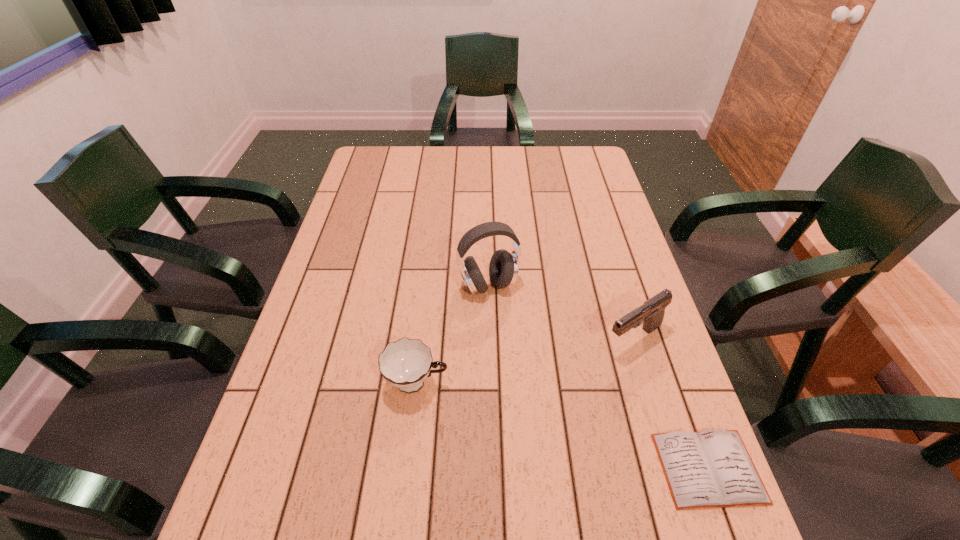
Where is `free region located on the ear cups of the farthest object`? free region located on the ear cups of the farthest object is located at coordinates (541, 437).

The height and width of the screenshot is (540, 960). In order to click on vacant space located 0.390m on the ear cups of the farthest object in this screenshot , I will do `click(543, 442)`.

Locate an element on the screen. free space located on the ear cups of the farthest object is located at coordinates (526, 390).

At what (x,y) coordinates should I click in order to perform the action: click on vacant area located 0.060m aim along the barrel of the third shortest object. Please return your answer as a coordinate pair (x, y). Looking at the image, I should click on (591, 363).

Identify the location of vacant space located 0.400m aim along the barrel of the third shortest object. The image size is (960, 540). (470, 446).

This screenshot has height=540, width=960. In order to click on free location located 0.080m aim along the barrel of the third shortest object in this screenshot , I will do `click(586, 368)`.

Locate an element on the screen. object present at the near edge is located at coordinates [x=710, y=469].

I want to click on diary at the right edge, so pyautogui.click(x=710, y=469).

This screenshot has height=540, width=960. What are the coordinates of `pistol that is at the right edge` in the screenshot? It's located at (651, 314).

In order to click on object located at the near right corner in this screenshot , I will do `click(710, 469)`.